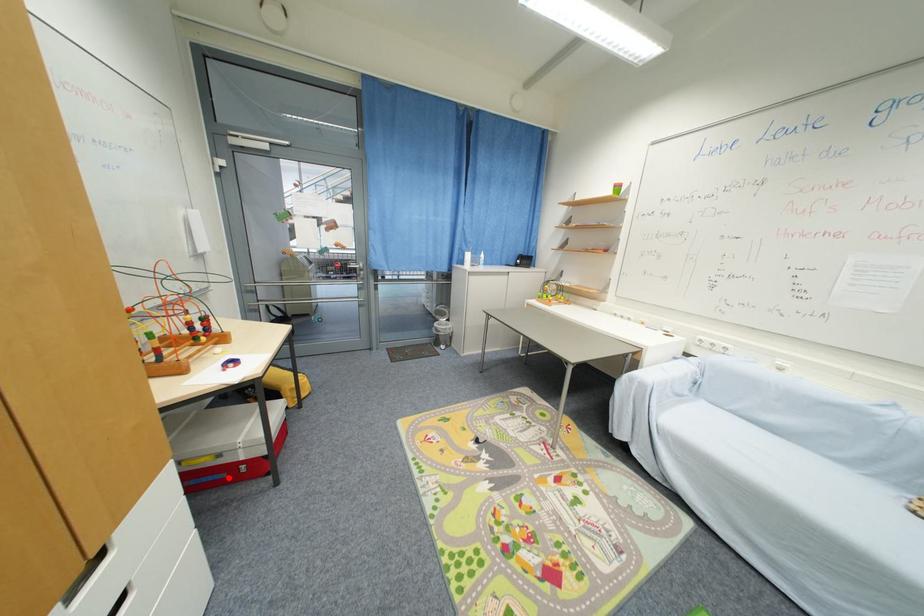
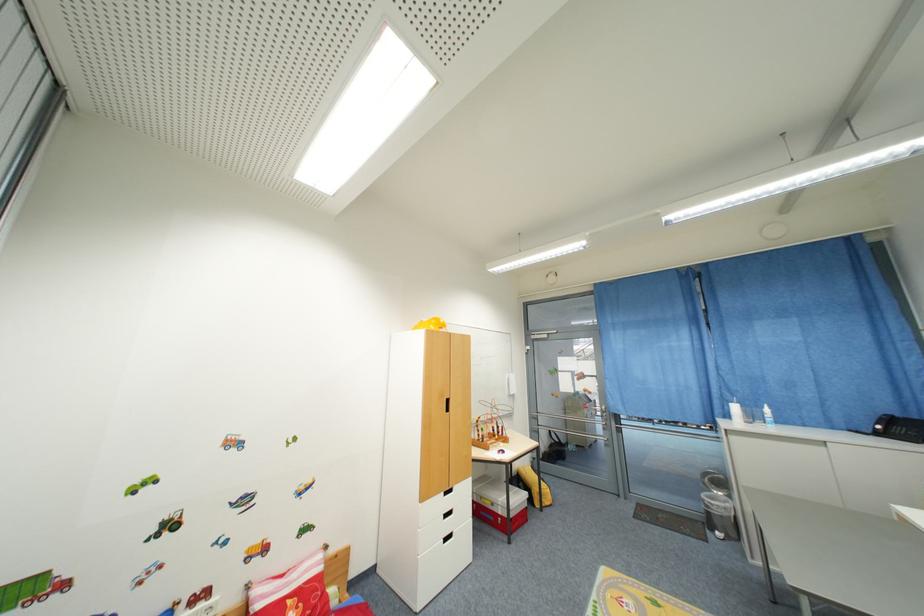
Question: A red point is marked in image1. In image2, is the corresponding 3D point closer to the camera or farther? Reply with the corresponding letter.

Choices:
 (A) The corresponding 3D point is closer.
 (B) The corresponding 3D point is farther.

Answer: (B)